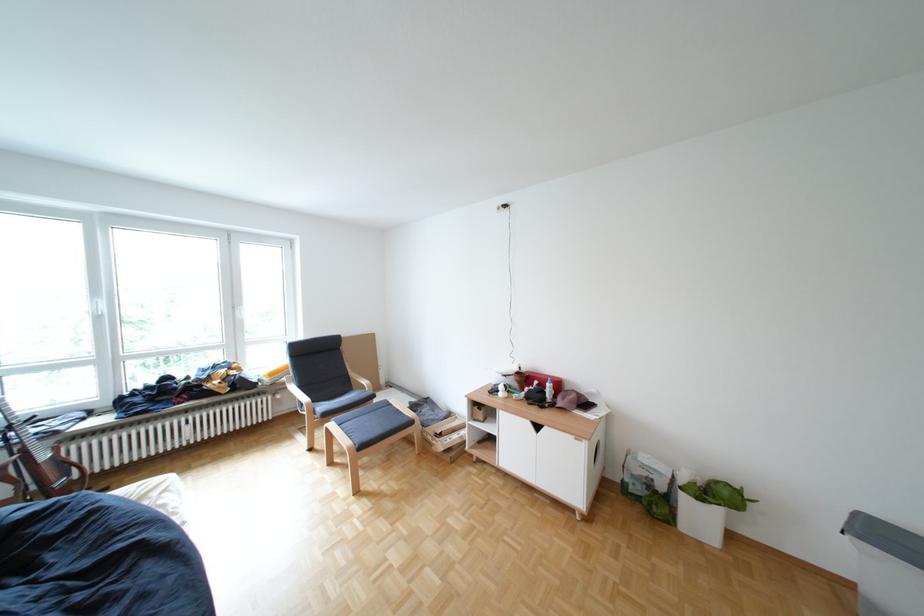
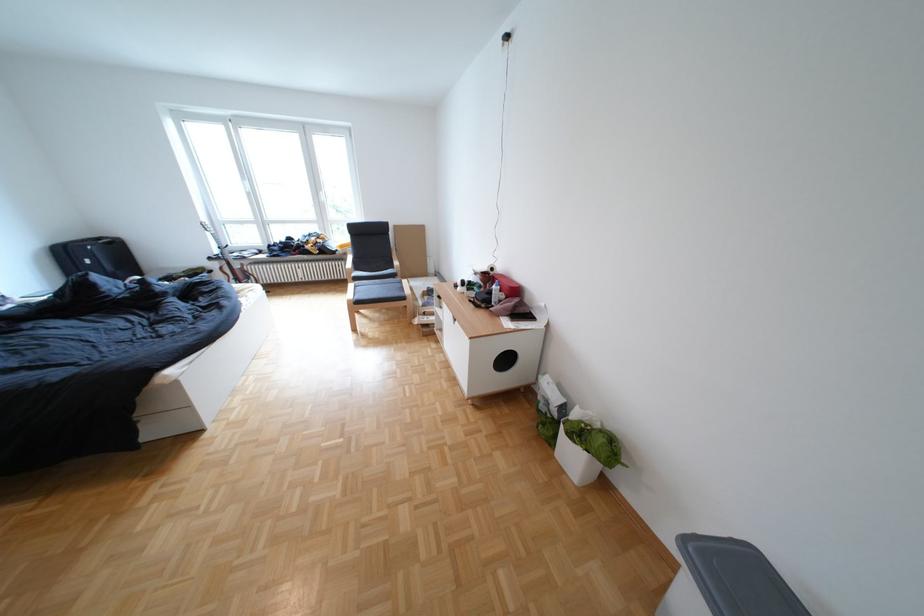
Where in the second image is the point corresponding to (x=643, y=485) from the first image?

(554, 402)